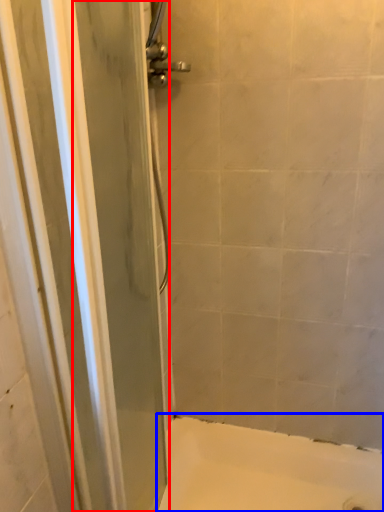
Question: Which point is closer to the camera, screen door (highlighted by a red box) or bath (highlighted by a blue box)?

Choices:
 (A) screen door
 (B) bath

Answer: (A)